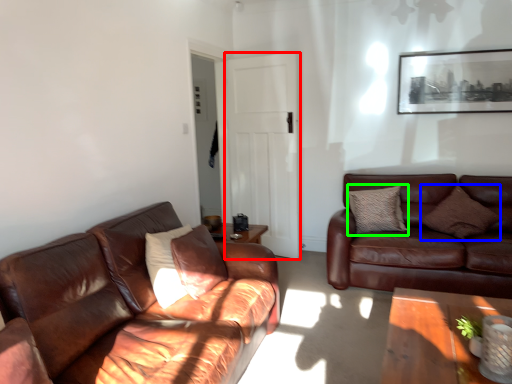
Question: Considering the real-world distances, which object is closest to glass door (highlighted by a red box)? pillow (highlighted by a blue box) or pillow (highlighted by a green box).

Choices:
 (A) pillow
 (B) pillow

Answer: (B)